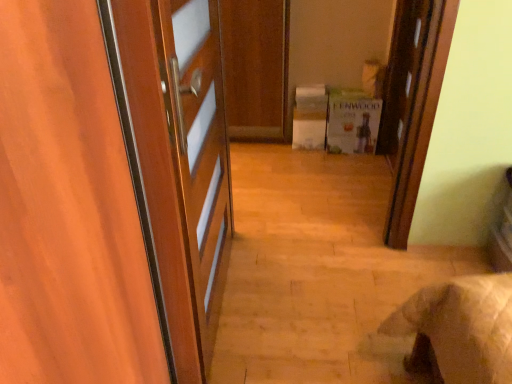
Question: Is wooden door at left, which is the first door from left to right, inside the boundaries of wooden door at upper right, which is the first door from right to left, or outside?

Choices:
 (A) inside
 (B) outside

Answer: (B)

Question: Is wooden door at left, which is the 2th door from right to left, taller or shorter than wooden door at upper right, marked as the 2th door in a front-to-back arrangement?

Choices:
 (A) short
 (B) tall

Answer: (B)

Question: Estimate the real-world distances between objects in this image. Which object is farther from the green cardboard box at center?

Choices:
 (A) wooden door at upper right, marked as the first door in a back-to-front arrangement
 (B) wooden door at left, which is counted as the first door, starting from the bottom

Answer: (B)

Question: Considering the real-world distances, which object is farthest from the green cardboard box at center?

Choices:
 (A) wooden door at upper right, marked as the 2th door in a front-to-back arrangement
 (B) wooden door at left, which is counted as the first door, starting from the bottom

Answer: (B)